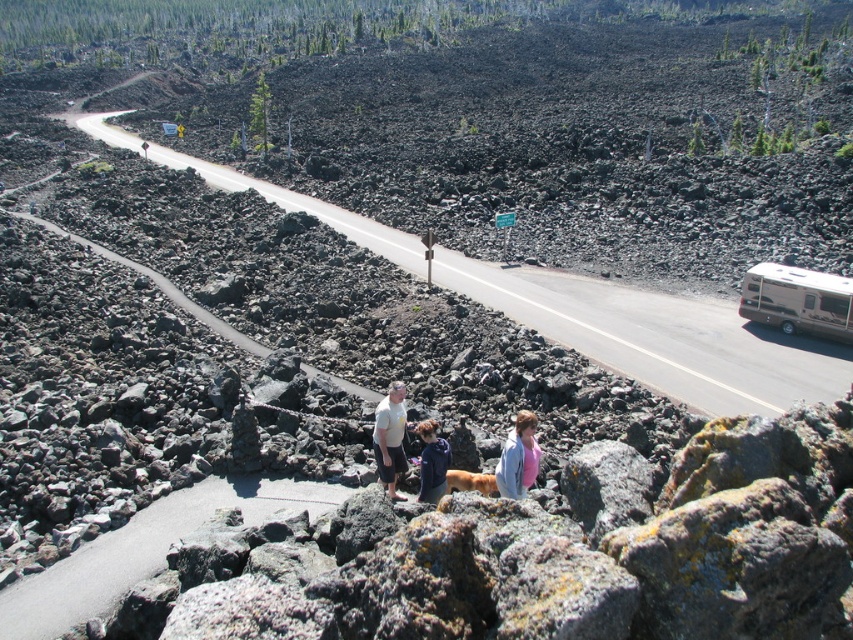
You are standing at the point with coordinates 0.5, 0.7 on the image. Which direction should you move to reach the asphalt road at center?

The asphalt road at center is located at coordinates (659, 337). Since you are at (596, 320), you should move northeast to reach it.

You are a tourist standing at the edge of the road in the lava field. You see the beige metallic tour bus at right and the dark blue jacket at center. Which object is located to the right of the other?

The beige metallic tour bus at right is located to the right of the dark blue jacket at center.

You are a tour guide planning to drive a beige metallic tour bus at right along the asphalt road at center. Considering the height difference between the road and the bus, will the bus be able to pass under a low bridge that is exactly at the height of the road?

The asphalt road at center has a greater height compared to the beige metallic tour bus at right. This means the bus is shorter than the road height, so it can safely pass under the bridge without any issues.